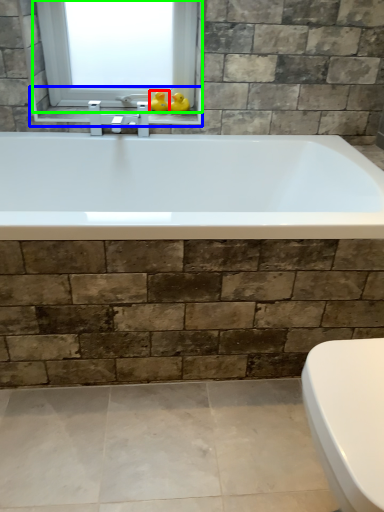
Question: Estimate the real-world distances between objects in this image. Which object is farther from duck (highlighted by a red box), window sill (highlighted by a blue box) or window (highlighted by a green box)?

Choices:
 (A) window sill
 (B) window

Answer: (B)